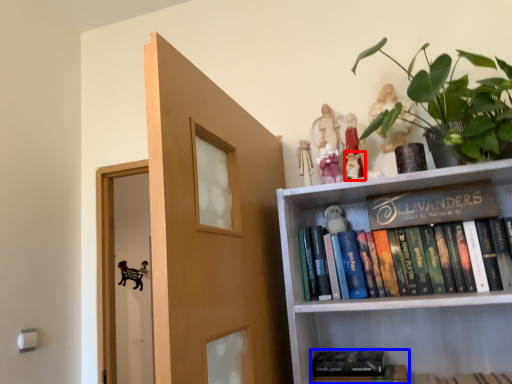
Question: Which object appears closest to the camera in this image, toy (highlighted by a red box) or book (highlighted by a blue box)?

Choices:
 (A) toy
 (B) book

Answer: (B)